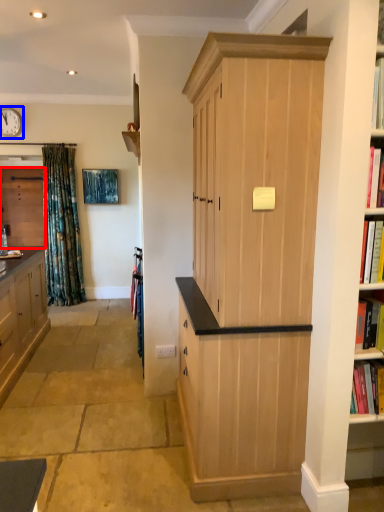
Question: Which object appears farthest to the camera in this image, cabinetry (highlighted by a red box) or clock (highlighted by a blue box)?

Choices:
 (A) cabinetry
 (B) clock

Answer: (A)